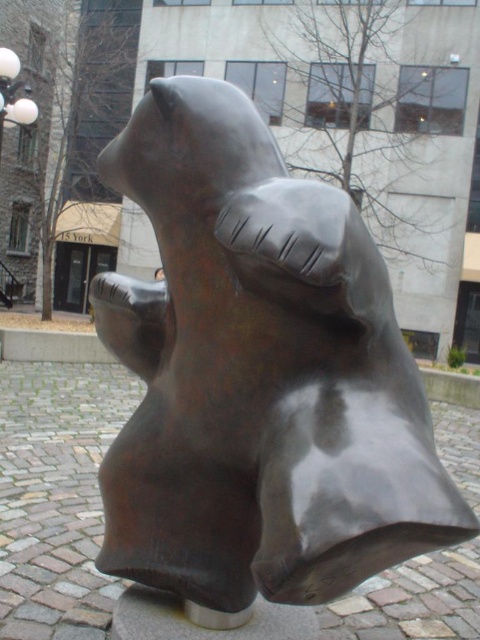
Which is more to the left, bronze bear at center or white glass lamp post at upper left?

white glass lamp post at upper left is more to the left.

Which of these two, bronze bear at center or white glass lamp post at upper left, stands taller?

white glass lamp post at upper left

Who is more forward, (144, 404) or (0, 52)?

Positioned in front is point (144, 404).

The width and height of the screenshot is (480, 640). In order to click on bronze bear at center in this screenshot , I will do coord(257,374).